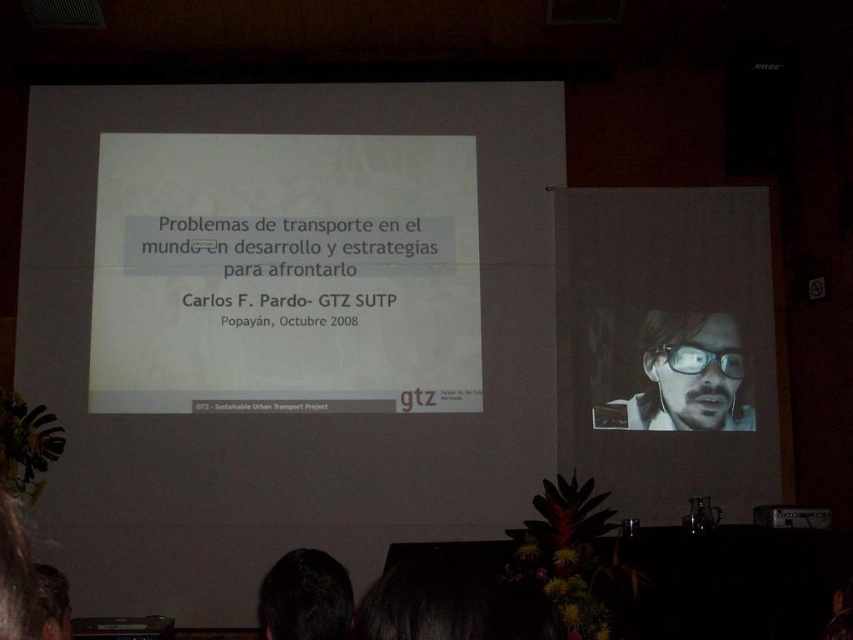
Question: Can you confirm if matte white screen at right is bigger than matte black glasses at upper right?

Choices:
 (A) no
 (B) yes

Answer: (B)

Question: Which object is positioned farthest from the matte black glasses at upper right?

Choices:
 (A) dark brown hair at lower center
 (B) matte white screen at right

Answer: (A)

Question: Is matte white screen at right bigger than dark brown hair at lower center?

Choices:
 (A) no
 (B) yes

Answer: (B)

Question: Which of the following is the closest to the observer?

Choices:
 (A) (265, 589)
 (B) (695, 289)

Answer: (A)

Question: Which object is farther from the camera taking this photo?

Choices:
 (A) dark brown hair at lower center
 (B) matte white screen at right

Answer: (B)

Question: Does matte black glasses at upper right appear on the right side of dark brown hair at lower center?

Choices:
 (A) yes
 (B) no

Answer: (A)